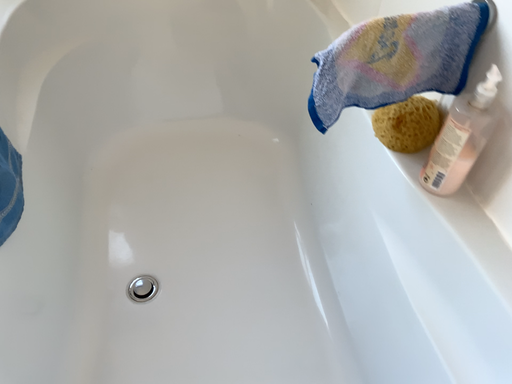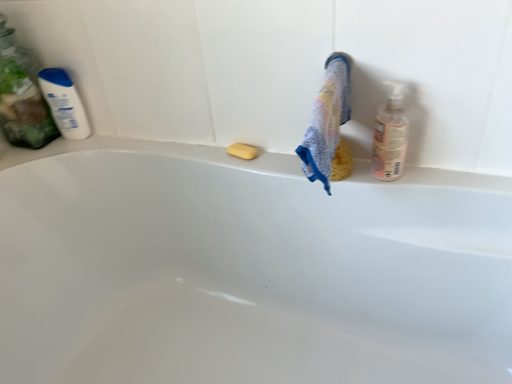
Question: Which way did the camera rotate in the video?

Choices:
 (A) rotated left
 (B) rotated right

Answer: (B)